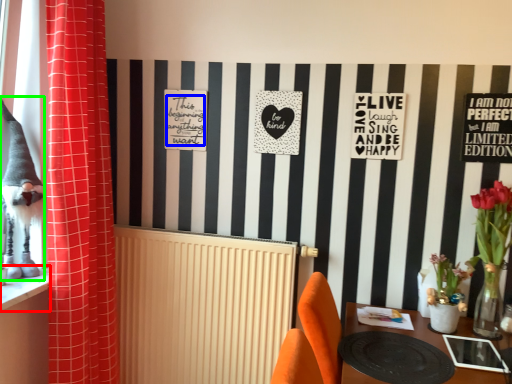
Question: Considering the real-world distances, which object is closest to window sill (highlighted by a red box)? writing (highlighted by a blue box) or animal (highlighted by a green box).

Choices:
 (A) writing
 (B) animal

Answer: (B)